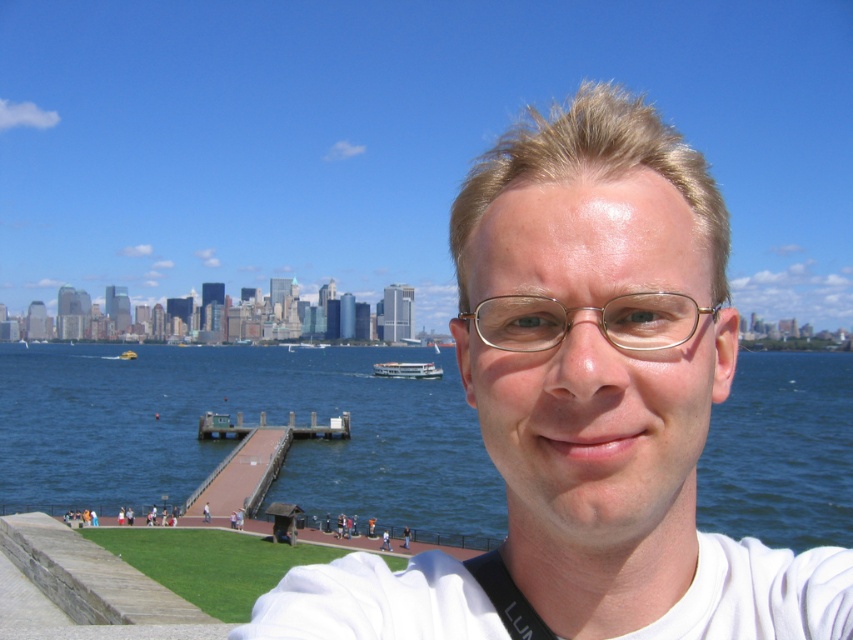
Based on the photo, you are a photographer trying to capture the city skyline in the background. You notice a point at coordinates (247, 422) in the image. What is located at this point?

The point at coordinates (247, 422) indicates blue water at center.

You are a photographer trying to capture the reflection of the city skyline in the blue water at center. The gold metallic glasses at center might interfere with the reflection. Which object should you adjust to ensure the reflection is visible?

The blue water at center is larger in size than the gold metallic glasses at center. To ensure the reflection is visible, you should adjust the gold metallic glasses at center so they are not blocking the larger blue water at center.